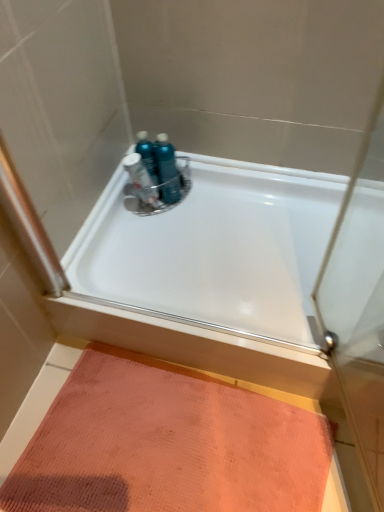
The width and height of the screenshot is (384, 512). What are the coordinates of `free point above orange textured mat at lower left (from a real-world perspective)` in the screenshot? It's located at (170, 441).